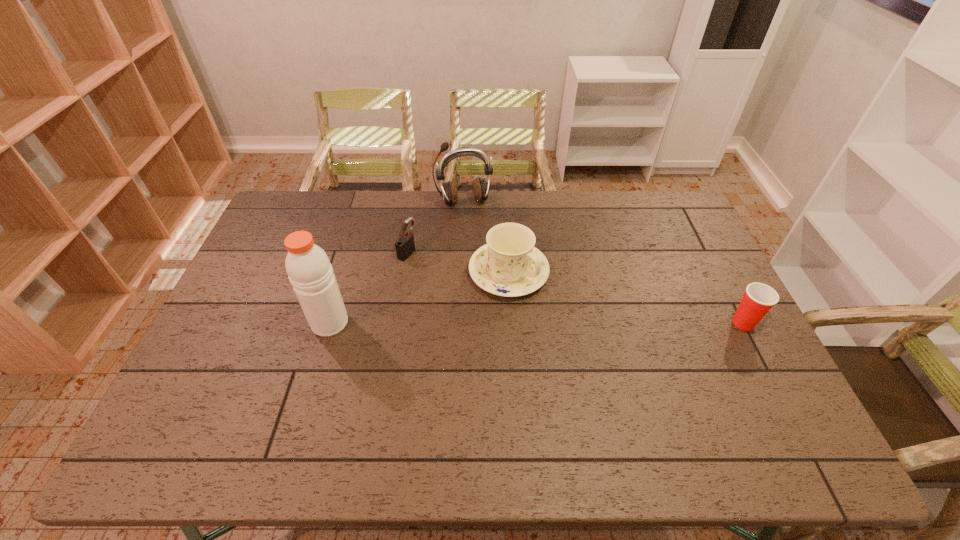
Where is `free space on the desktop that is between the tallest object and the rightmost object and is positioned with the keyhole on the front of the padlock`? The image size is (960, 540). free space on the desktop that is between the tallest object and the rightmost object and is positioned with the keyhole on the front of the padlock is located at coordinates (577, 323).

At what (x,y) coordinates should I click in order to perform the action: click on free spot on the desktop that is between the shaker and the rightmost object and is positioned on the ear pads of the farthest object. Please return your answer as a coordinate pair (x, y). The height and width of the screenshot is (540, 960). Looking at the image, I should click on (499, 323).

Where is `free spot on the desktop that is between the tallest object and the rightmost object and is positioned on the handle side of the chinaware`? free spot on the desktop that is between the tallest object and the rightmost object and is positioned on the handle side of the chinaware is located at coordinates (584, 323).